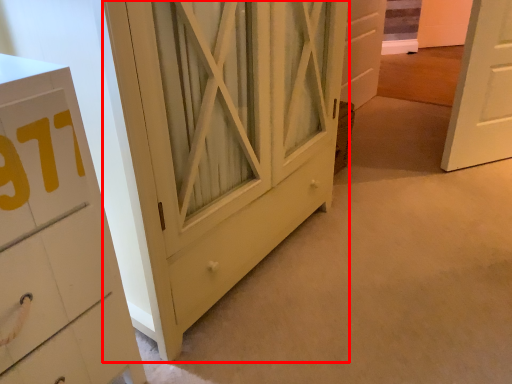
Question: From the image's perspective, what is the correct spatial relationship of barn door (annotated by the red box) in relation to door?

Choices:
 (A) below
 (B) above

Answer: (A)